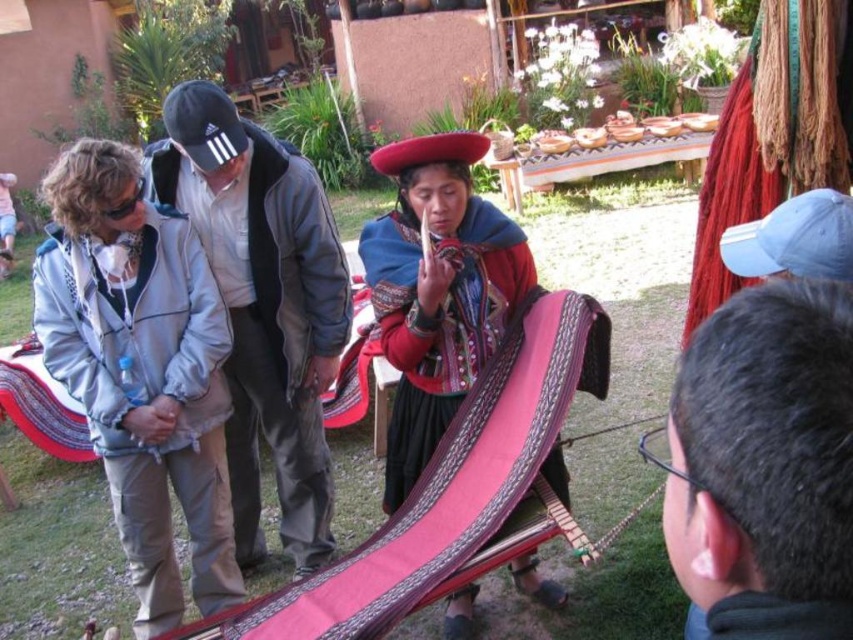
Question: Which point is closer to the camera?

Choices:
 (A) gray fabric at left
 (B) matte red fabric at center

Answer: (A)

Question: Which object is positioned farthest from the red yarn at right?

Choices:
 (A) matte red fabric at center
 (B) dark gray hair at upper right

Answer: (B)

Question: Which object is positioned closest to the gray fabric jacket at center?

Choices:
 (A) dark gray hair at upper right
 (B) red yarn at right
 (C) gray fabric at left

Answer: (C)

Question: Does gray fabric jacket at center have a lesser width compared to red yarn at right?

Choices:
 (A) no
 (B) yes

Answer: (A)

Question: Can you confirm if gray fabric at left is positioned below dark gray hair at upper right?

Choices:
 (A) yes
 (B) no

Answer: (A)

Question: Does gray fabric jacket at center have a lesser width compared to matte red fabric at center?

Choices:
 (A) no
 (B) yes

Answer: (A)